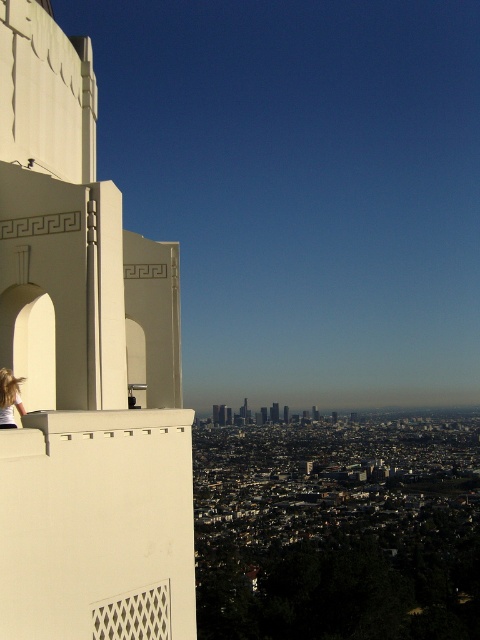
Can you confirm if white concrete tower at left is wider than matte white skyscraper at center?

Indeed, white concrete tower at left has a greater width compared to matte white skyscraper at center.

Consider the image. Can you confirm if white concrete tower at left is positioned above matte white skyscraper at center?

Correct, white concrete tower at left is located above matte white skyscraper at center.

Is point (15, 444) farther from camera compared to point (276, 403)?

No, it is in front of (276, 403).

This screenshot has height=640, width=480. I want to click on white concrete tower at left, so click(x=84, y=369).

Who is positioned more to the right, white concrete tower at left or blonde hair at left?

white concrete tower at left is more to the right.

Can you confirm if white concrete tower at left is thinner than blonde hair at left?

No.

Is point (132, 627) positioned in front of point (3, 371)?

Yes, point (132, 627) is in front of point (3, 371).

In order to click on white concrete tower at left in this screenshot , I will do `click(84, 369)`.

How much distance is there between blonde hair at left and matte white skyscraper at center?

They are 171.06 meters apart.

Is blonde hair at left to the right of matte white skyscraper at center from the viewer's perspective?

In fact, blonde hair at left is to the left of matte white skyscraper at center.

Where is `blonde hair at left`? blonde hair at left is located at coordinates pyautogui.click(x=9, y=397).